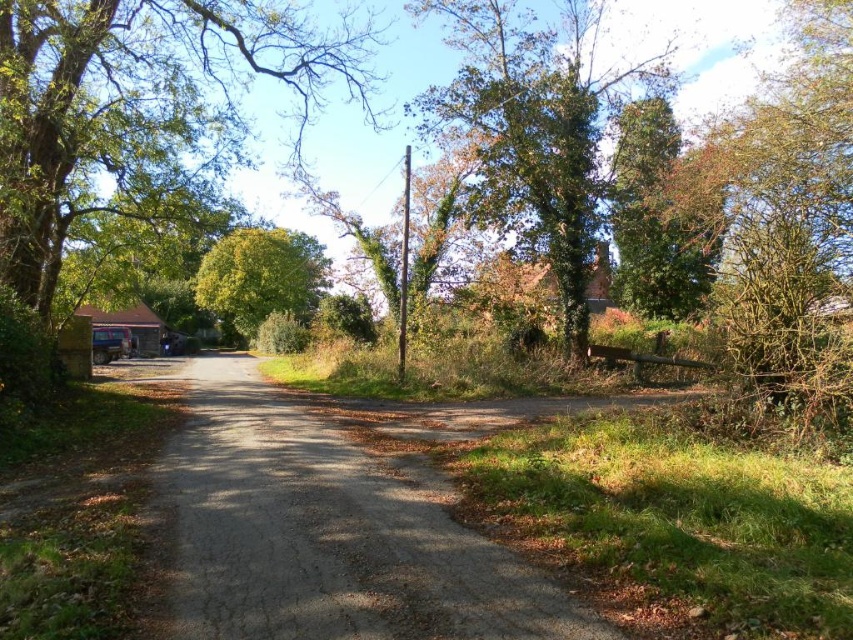
Question: Is green leafy tree at upper center below green leafy tree at center?

Choices:
 (A) no
 (B) yes

Answer: (A)

Question: Which object is farther from the camera taking this photo?

Choices:
 (A) green leafy tree at upper center
 (B) green leafy tree at left

Answer: (A)

Question: Does gray gravel road at center have a larger size compared to green leafy tree at center?

Choices:
 (A) yes
 (B) no

Answer: (B)

Question: Is gray gravel road at center closer to the viewer compared to green leafy tree at left?

Choices:
 (A) yes
 (B) no

Answer: (A)

Question: Which is farther from the green leafy tree at upper center?

Choices:
 (A) green leafy tree at center
 (B) gray gravel road at center

Answer: (A)

Question: Which object is positioned farthest from the green leafy tree at upper center?

Choices:
 (A) green leafy tree at center
 (B) green leafy tree at left

Answer: (A)